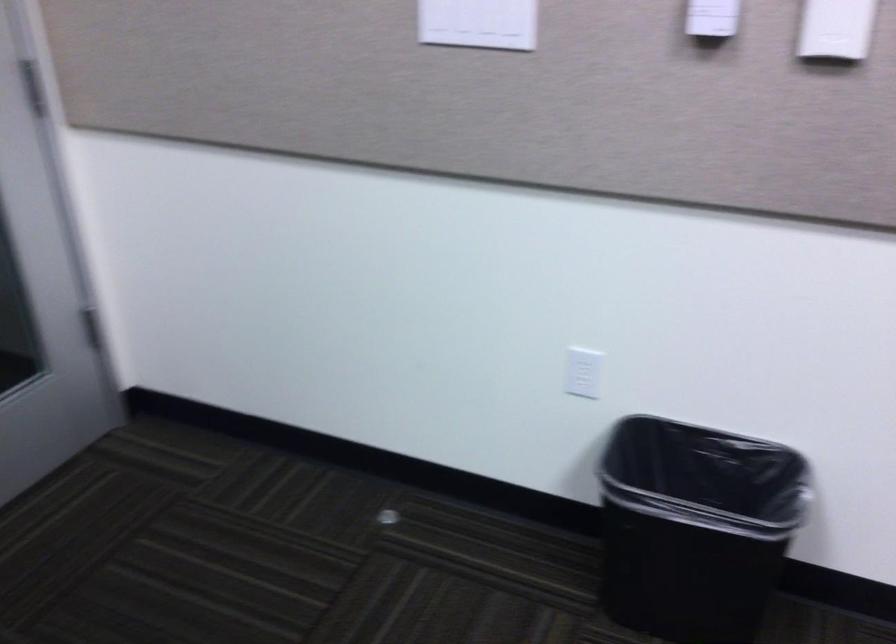
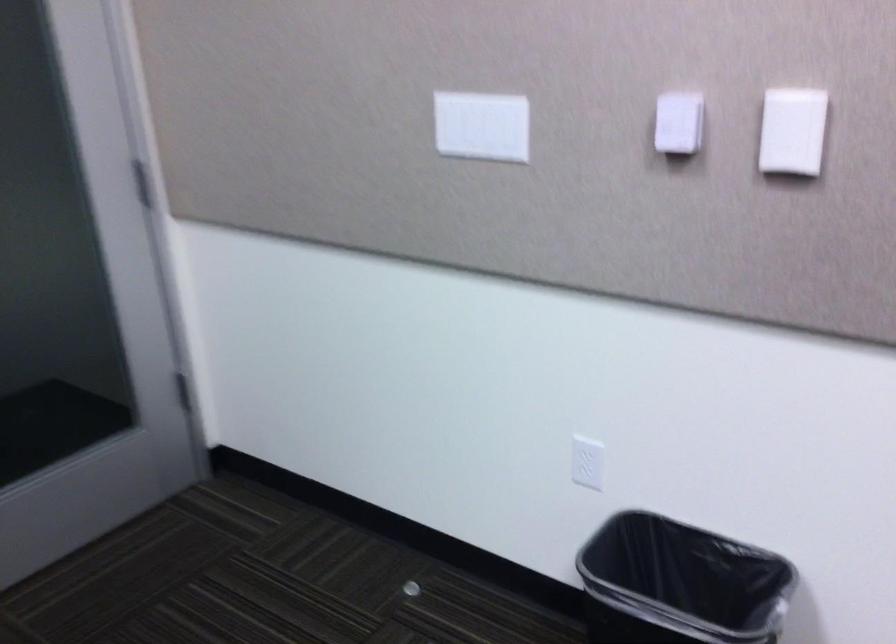
In the second image, find the point that corresponds to (x=583, y=373) in the first image.

(587, 462)